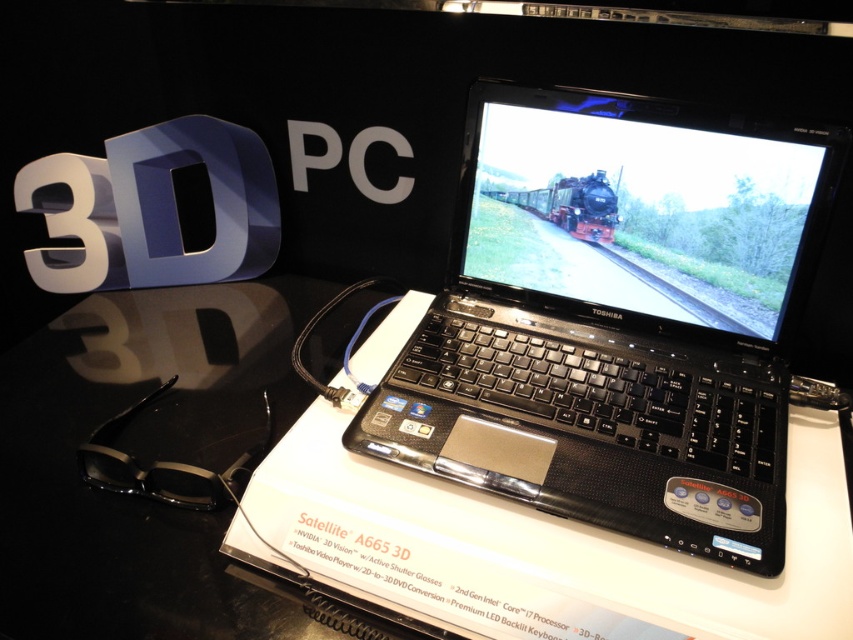
Is black plastic laptop at center closer to the viewer compared to gray asphalt train track at center?

Yes, black plastic laptop at center is closer to the viewer.

Locate an element on the screen. The width and height of the screenshot is (853, 640). black plastic laptop at center is located at coordinates (618, 321).

Between black plastic laptop at center and matte black train at center, which one has less height?

matte black train at center

Which is behind, point (782, 301) or point (589, 196)?

The point (589, 196) is behind.

At what (x,y) coordinates should I click in order to perform the action: click on black plastic laptop at center. Please return your answer as a coordinate pair (x, y). This screenshot has width=853, height=640. Looking at the image, I should click on (618, 321).

Which of these two, black glossy table at center or matte black train at center, stands taller?

With more height is black glossy table at center.

The height and width of the screenshot is (640, 853). What do you see at coordinates (329, 500) in the screenshot?
I see `black glossy table at center` at bounding box center [329, 500].

This screenshot has width=853, height=640. Identify the location of black glossy table at center. (329, 500).